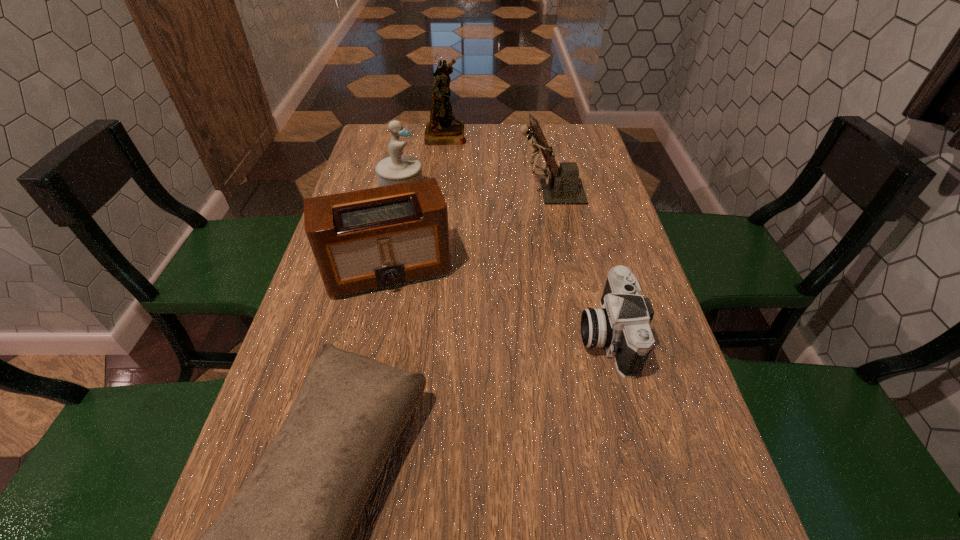
This screenshot has width=960, height=540. In order to click on the farthest figurine in this screenshot , I will do `click(443, 129)`.

At what (x,y) coordinates should I click in order to perform the action: click on the rightmost figurine. Please return your answer as a coordinate pair (x, y). The width and height of the screenshot is (960, 540). Looking at the image, I should click on (564, 187).

Locate an element on the screen. radio receiver is located at coordinates (367, 240).

At what (x,y) coordinates should I click in order to perform the action: click on camera. Please return your answer as a coordinate pair (x, y). Looking at the image, I should click on (621, 325).

In order to click on free space located on the front-facing side of the farthest figurine in this screenshot , I will do `click(568, 134)`.

I want to click on free space located 0.260m on the front-facing side of the rightmost figurine, so click(426, 192).

Image resolution: width=960 pixels, height=540 pixels. I want to click on free location located on the front-facing side of the rightmost figurine, so click(461, 192).

Where is `vacant space located on the front-facing side of the rightmost figurine`? vacant space located on the front-facing side of the rightmost figurine is located at coordinates (405, 192).

You are a GUI agent. You are given a task and a screenshot of the screen. Output one action in this format:
    pyautogui.click(x=<x>, y=<y>)
    Task: Click on the vacant point located on the front of the radio receiver
    This screenshot has width=960, height=540.
    Given the screenshot: What is the action you would take?
    pyautogui.click(x=350, y=448)

In order to click on vacant space located on the back of the camera in this screenshot , I will do `click(593, 278)`.